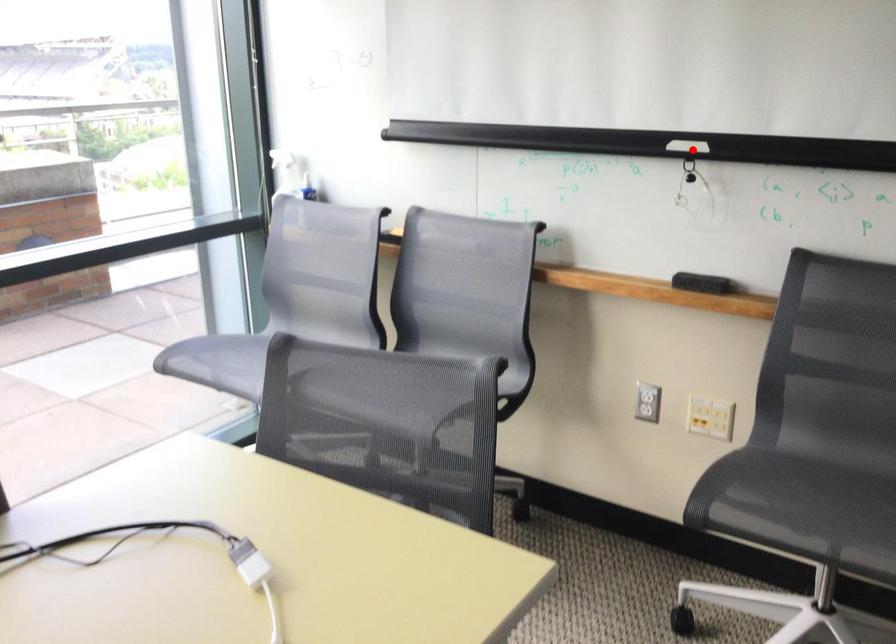
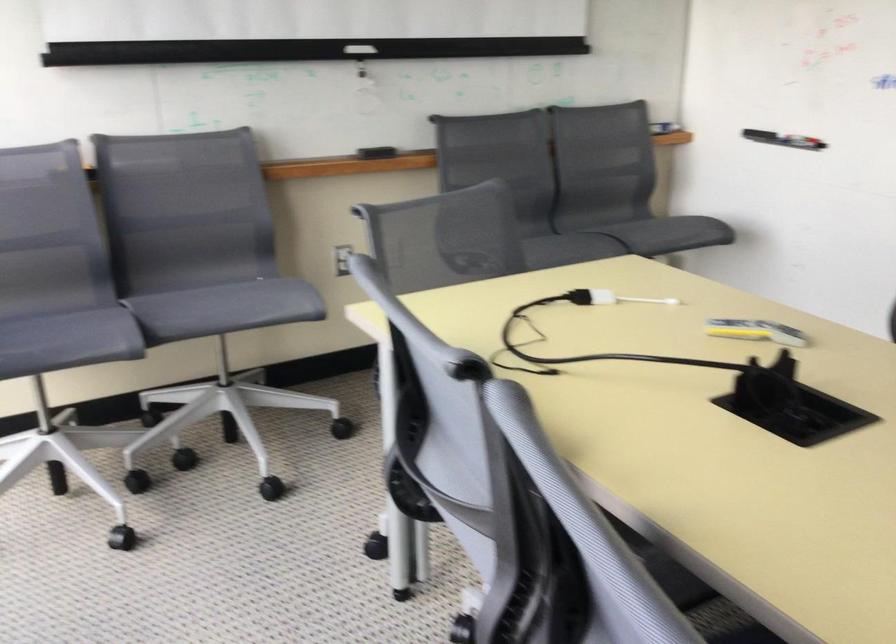
Question: I am providing you with two images of the same scene from different viewpoints. Image1 has a red point marked. In image2, the corresponding 3D location appears at what relative position? Reply with the corresponding letter.

Choices:
 (A) Closer
 (B) Farther

Answer: (B)